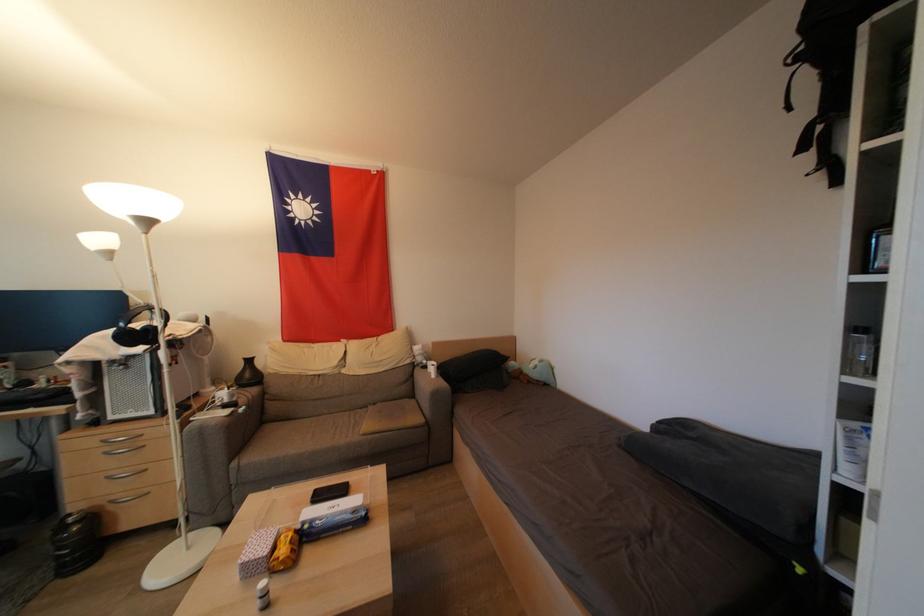
Identify the location of black headphones. click(138, 329).